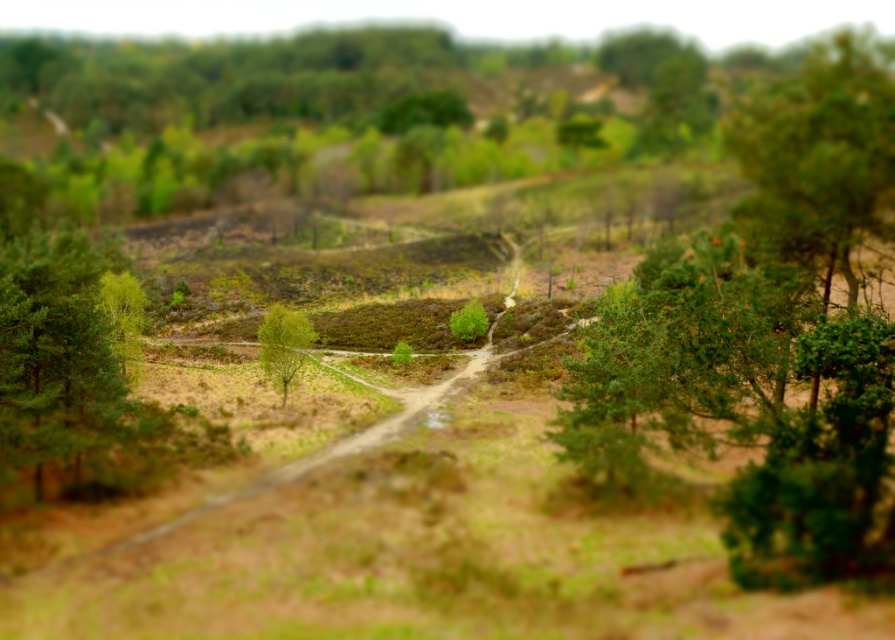
Question: Which of the following is the closest to the observer?

Choices:
 (A) green matte tree at right
 (B) green leafy tree at center

Answer: (A)

Question: From the image, what is the correct spatial relationship of green matte tree at right in relation to green leafy tree at center?

Choices:
 (A) right
 (B) left

Answer: (A)

Question: Which point is closer to the camera taking this photo?

Choices:
 (A) (606, 348)
 (B) (293, 372)

Answer: (A)

Question: Is green matte tree at right to the left of green leafy tree at center from the viewer's perspective?

Choices:
 (A) no
 (B) yes

Answer: (A)

Question: Is green matte tree at right in front of green leafy tree at center?

Choices:
 (A) no
 (B) yes

Answer: (B)

Question: Which point is farther from the camera taking this photo?

Choices:
 (A) (725, 493)
 (B) (279, 324)

Answer: (B)